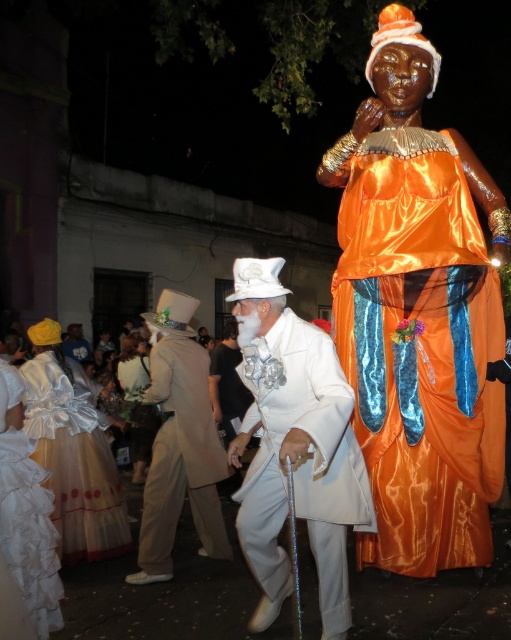
Looking at this image, you are standing at the center of the street and see a man in an elaborate white suit and top hat holding a cane. To your right, there is a point marked at coordinates (73, 451). What object is located at this point?

The point at (73, 451) corresponds to the white satin dress at lower left.

You are a photographer trying to capture a photo of both the satin orange dress at right and the tan fabric top hat at center. Since you want them both in frame, which direction should you move your camera to include both objects?

You should move your camera to the left to include both the satin orange dress at right and the tan fabric top hat at center, as the satin orange dress at right is positioned to the right of the tan fabric top hat at center.